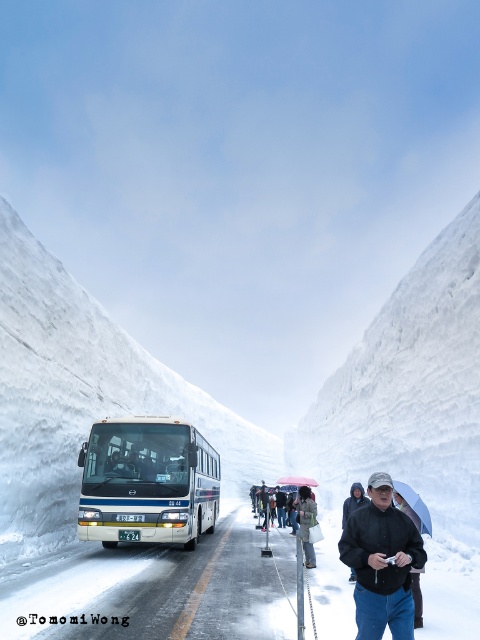
You are a pedestrian standing at the black matte jacket at lower right position. You need to cross the road to reach the opposite snow wall. The road is 10 meters wide. Can you safely cross the road before the white glossy bus at center arrives?

The distance between the white glossy bus at center and the black matte jacket at lower right is 9.14 meters. Since the road is 10 meters wide, the bus is still 0.86 meters away from reaching the pedestrian. Therefore, the pedestrian can safely cross the road before the white glossy bus at center arrives.

You are a passenger in the white bus with blue stripes and notice a transparent plastic umbrella at lower center. According to the scene, where exactly is the transparent plastic umbrella positioned relative to the bus?

The transparent plastic umbrella at lower center is located at point 0.789 on the x axis and 0.865 on the y axis relative to the bus.